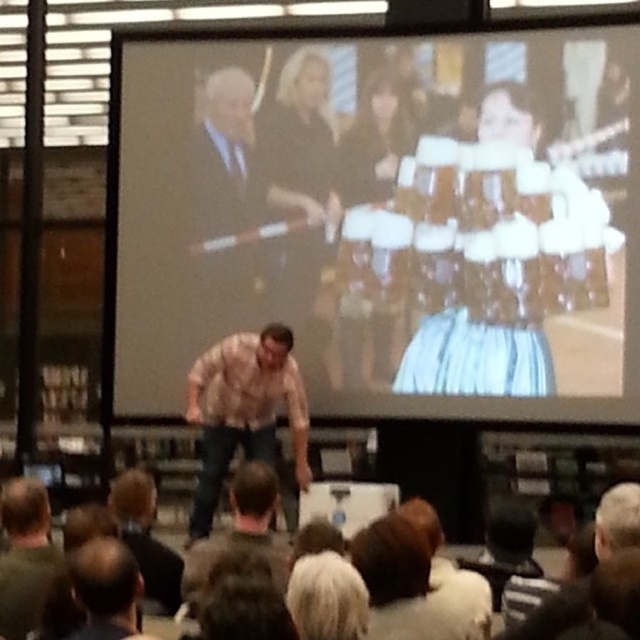
You are sitting in the conference room and looking at the projection screen. There are two points marked on the screen at coordinates point (195, 496) and point (612, 536). Which point is closer to you?

Point (195, 496) is closer to you because it is further to the viewer than point (612, 536).

You are attending a presentation in the conference room and notice two items in the foreground. The first is a plaid shirt at center, and the second is a white wool sweater at lower center. From your perspective, which item is closer to you?

The plaid shirt at center is closer to you because the white wool sweater at lower center is behind it.